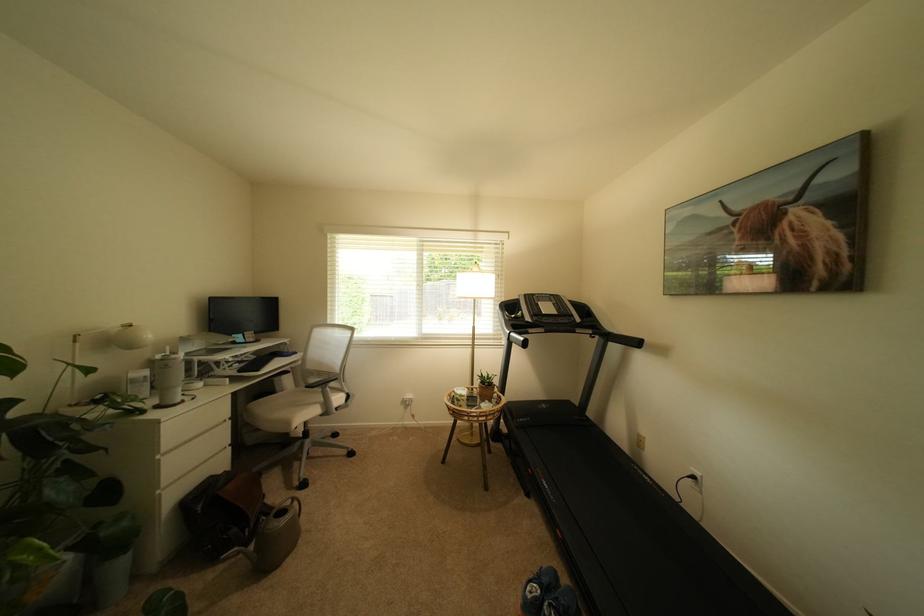
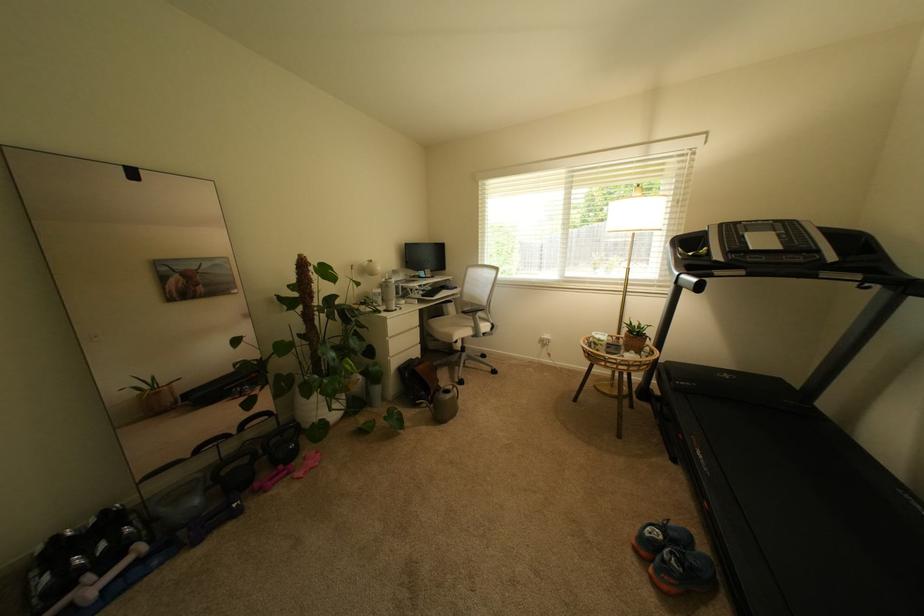
In the second image, find the point that corresponds to [447,277] in the first image.

(608, 217)